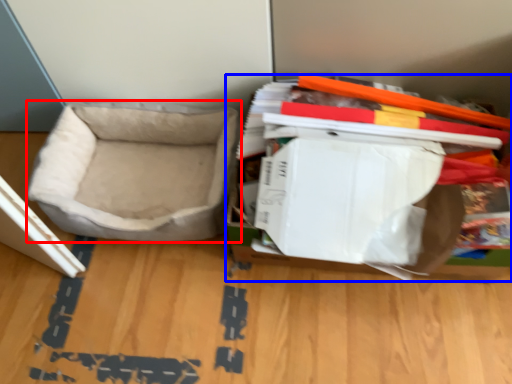
Question: Which point is closer to the camera, dog bed (highlighted by a red box) or storage box (highlighted by a blue box)?

Choices:
 (A) dog bed
 (B) storage box

Answer: (B)